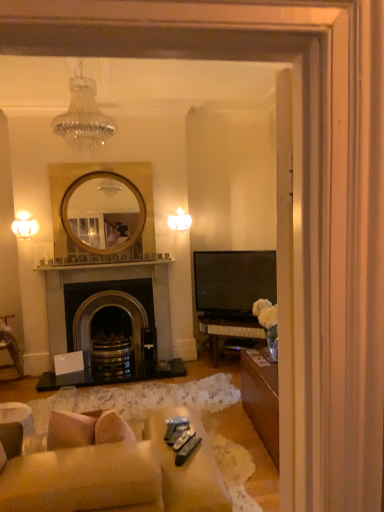
Question: Is matte white sconce at left, placed as the second lamp when sorted from back to front, next to black plastic remote control at lower center, the 3th remote control from the front?

Choices:
 (A) no
 (B) yes

Answer: (A)

Question: Is matte white sconce at left, arranged as the 1th lamp when viewed from the left, at the right side of black plastic remote control at lower center, which is counted as the first remote control, starting from the back?

Choices:
 (A) yes
 (B) no

Answer: (B)

Question: Can you confirm if matte white sconce at left, marked as the 1th lamp in a bottom-to-top arrangement, is positioned to the left of black plastic remote control at lower center, the 3th remote control from the front?

Choices:
 (A) yes
 (B) no

Answer: (A)

Question: Is matte white sconce at left, arranged as the 1th lamp when viewed from the left, wider than black plastic remote control at lower center, which is counted as the first remote control, starting from the back?

Choices:
 (A) yes
 (B) no

Answer: (B)

Question: Is matte white sconce at left, arranged as the 1th lamp when viewed from the left, closer to camera compared to black plastic remote control at lower center, which is counted as the first remote control, starting from the back?

Choices:
 (A) yes
 (B) no

Answer: (B)

Question: Does point (187, 227) appear closer or farther from the camera than point (175, 448)?

Choices:
 (A) farther
 (B) closer

Answer: (A)

Question: Is matte white lampshade at upper center, positioned as the third lamp in left-to-right order, inside or outside of metallic silver remote control at lower center, placed as the second remote control when sorted from front to back?

Choices:
 (A) inside
 (B) outside

Answer: (B)

Question: Visually, is matte white lampshade at upper center, positioned as the third lamp in left-to-right order, positioned to the left or to the right of metallic silver remote control at lower center, placed as the second remote control when sorted from front to back?

Choices:
 (A) left
 (B) right

Answer: (A)

Question: From a real-world perspective, is matte white lampshade at upper center, the first lamp positioned from the right, above or below metallic silver remote control at lower center, placed as the second remote control when sorted from front to back?

Choices:
 (A) above
 (B) below

Answer: (A)

Question: In the image, is clear glass chandelier at upper center, marked as the 2th lamp in a right-to-left arrangement, on the left side or the right side of metallic gray remote control at lower center, the 3th remote control from the back?

Choices:
 (A) left
 (B) right

Answer: (A)

Question: From the image's perspective, is clear glass chandelier at upper center, acting as the 3th lamp starting from the back, located above or below metallic gray remote control at lower center, the 3th remote control from the back?

Choices:
 (A) below
 (B) above

Answer: (B)

Question: Is clear glass chandelier at upper center, the first lamp in the top-to-bottom sequence, spatially inside metallic gray remote control at lower center, the 1th remote control viewed from the front, or outside of it?

Choices:
 (A) outside
 (B) inside

Answer: (A)

Question: From a real-world perspective, relative to metallic gray remote control at lower center, the 3th remote control from the back, is clear glass chandelier at upper center, acting as the 3th lamp starting from the back, vertically above or below?

Choices:
 (A) above
 (B) below

Answer: (A)

Question: Considering the positions of metallic silver remote control at lower center, placed as the second remote control when sorted from front to back, and clear glass chandelier at upper center, marked as the 2th lamp in a right-to-left arrangement, in the image, is metallic silver remote control at lower center, placed as the second remote control when sorted from front to back, taller or shorter than clear glass chandelier at upper center, marked as the 2th lamp in a right-to-left arrangement,?

Choices:
 (A) short
 (B) tall

Answer: (A)

Question: From a real-world perspective, is metallic silver remote control at lower center, positioned as the second remote control in back-to-front order, positioned above or below clear glass chandelier at upper center, marked as the 2th lamp in a right-to-left arrangement?

Choices:
 (A) above
 (B) below

Answer: (B)